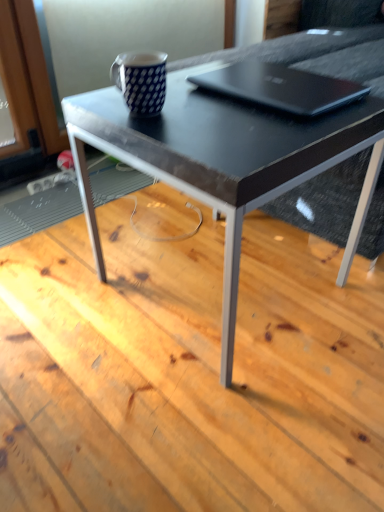
Question: Is the position of black glossy table at center more distant than that of blue dotted mug at upper center?

Choices:
 (A) no
 (B) yes

Answer: (A)

Question: From a real-world perspective, is black glossy table at center positioned under blue dotted mug at upper center based on gravity?

Choices:
 (A) no
 (B) yes

Answer: (B)

Question: Does black glossy table at center have a greater height compared to blue dotted mug at upper center?

Choices:
 (A) no
 (B) yes

Answer: (A)

Question: Is blue dotted mug at upper center surrounded by black glossy table at center?

Choices:
 (A) no
 (B) yes

Answer: (A)

Question: Considering the relative sizes of black glossy table at center and blue dotted mug at upper center in the image provided, is black glossy table at center thinner than blue dotted mug at upper center?

Choices:
 (A) no
 (B) yes

Answer: (A)

Question: Is black glossy table at center far from blue dotted mug at upper center?

Choices:
 (A) no
 (B) yes

Answer: (B)

Question: Could blue dotted mug at upper center be considered to be inside black matte laptop at upper center?

Choices:
 (A) no
 (B) yes

Answer: (A)

Question: Considering the relative positions of black matte laptop at upper center and blue dotted mug at upper center in the image provided, is black matte laptop at upper center to the left of blue dotted mug at upper center from the viewer's perspective?

Choices:
 (A) yes
 (B) no

Answer: (B)

Question: Can you confirm if black matte laptop at upper center is positioned to the right of blue dotted mug at upper center?

Choices:
 (A) yes
 (B) no

Answer: (A)

Question: Does black matte laptop at upper center have a smaller size compared to blue dotted mug at upper center?

Choices:
 (A) no
 (B) yes

Answer: (A)

Question: From a real-world perspective, is black matte laptop at upper center below blue dotted mug at upper center?

Choices:
 (A) no
 (B) yes

Answer: (B)

Question: Would you say black matte laptop at upper center is outside blue dotted mug at upper center?

Choices:
 (A) no
 (B) yes

Answer: (B)

Question: Is blue dotted mug at upper center wider than blue dotted mug at upper center?

Choices:
 (A) no
 (B) yes

Answer: (B)